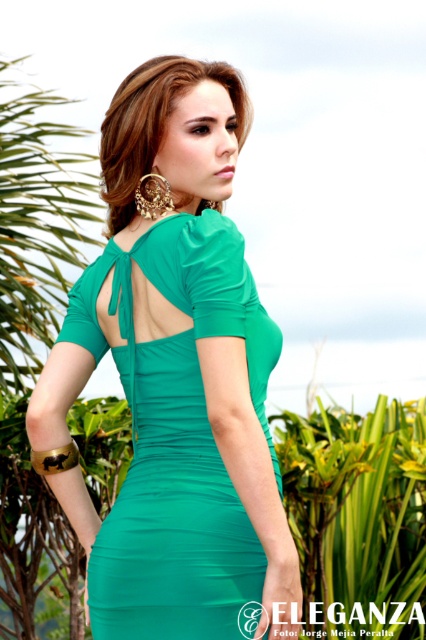
Does emerald green dress at center have a greater height compared to shiny gold earrings at upper center?

Correct, emerald green dress at center is much taller as shiny gold earrings at upper center.

Identify the location of emerald green dress at center. Image resolution: width=426 pixels, height=640 pixels. (173, 337).

Where is `emerald green dress at center`? emerald green dress at center is located at coordinates click(173, 337).